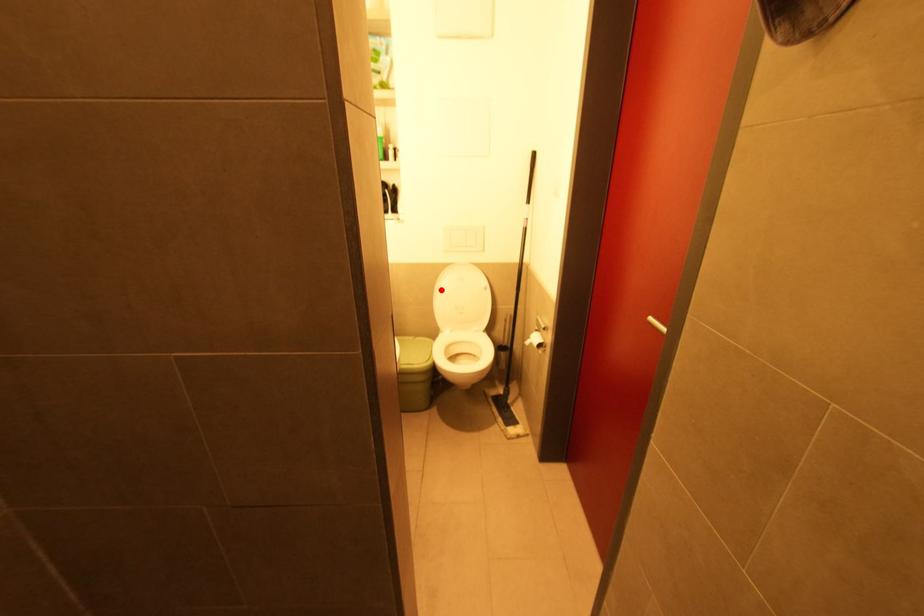
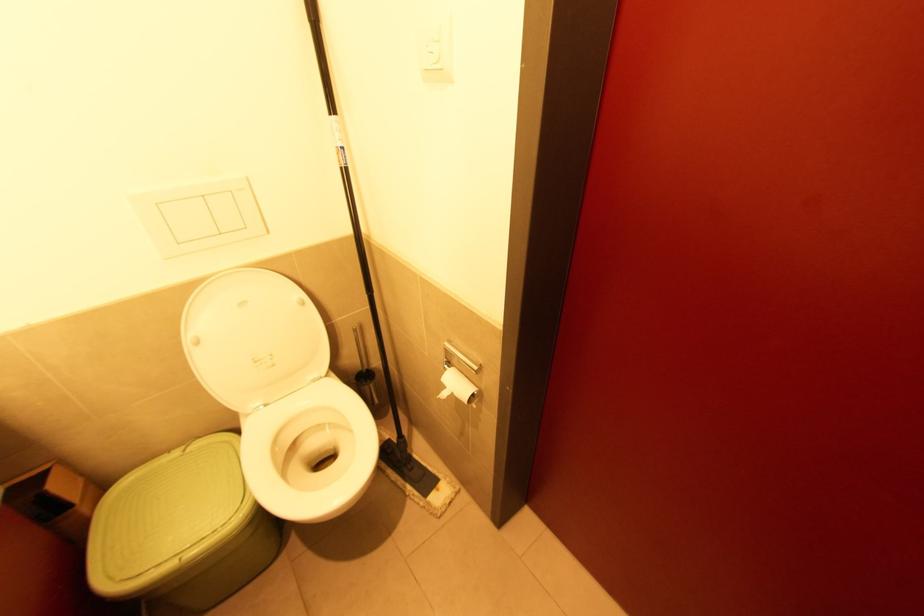
Question: I am providing you with two images of the same scene from different viewpoints. A red point is marked on the first image. At the location where the point appears in image 1, is it still visible in image 2?

Choices:
 (A) Yes
 (B) No

Answer: (A)